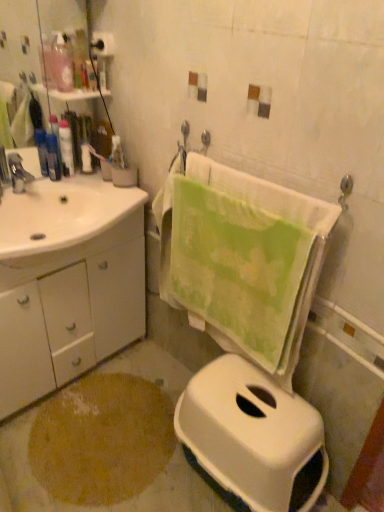
Where is `unoccupied area in front of matte silver faucet at left`? Image resolution: width=384 pixels, height=512 pixels. unoccupied area in front of matte silver faucet at left is located at coordinates pos(16,218).